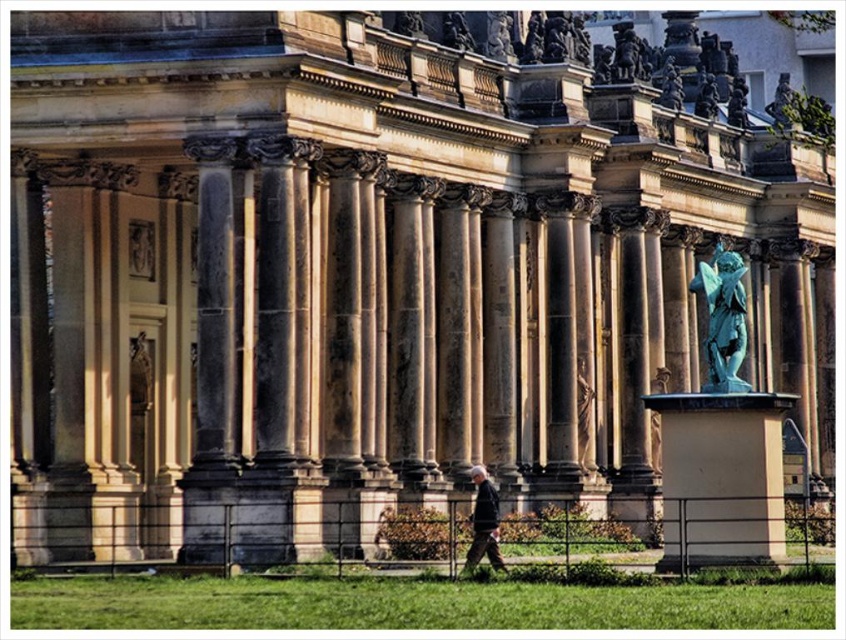
Looking at this image, you are standing in front of the classical building and see the dark gray fabric jacket at center and the smooth beige statue at center. Which object is closer to you?

The dark gray fabric jacket at center is closer to you because it is in front of the smooth beige statue at center.